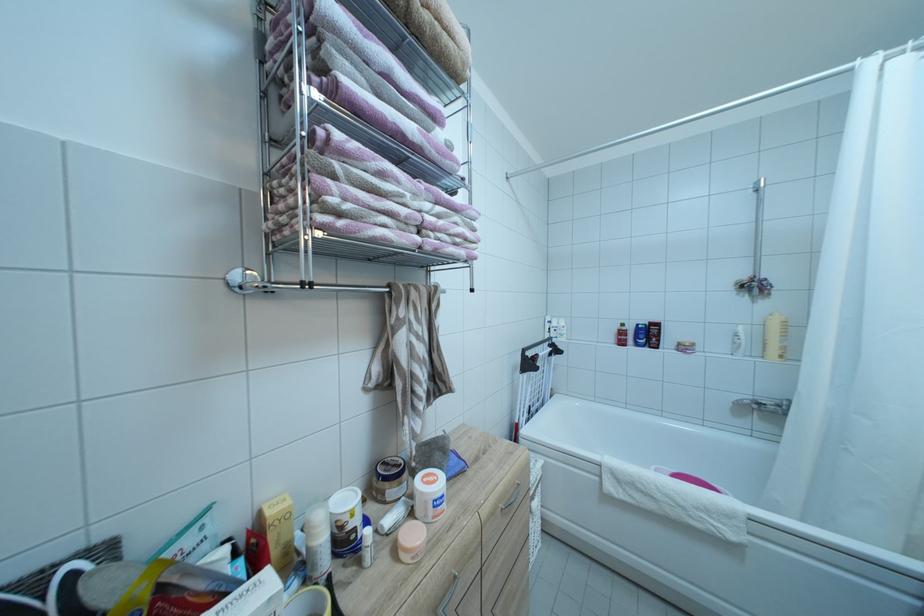
At what (x,y) coordinates should I click in order to perform the action: click on red shampoo bottle. Please return your answer as a coordinate pair (x, y). Looking at the image, I should click on (256, 551).